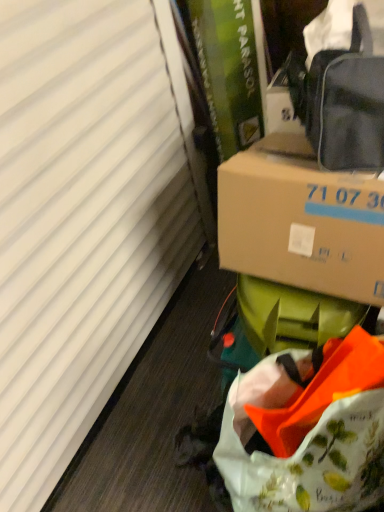
Question: From the image's perspective, is matte black bag at upper right beneath floral printed fabric bag at lower right?

Choices:
 (A) yes
 (B) no

Answer: (B)

Question: Does matte black bag at upper right come behind floral printed fabric bag at lower right?

Choices:
 (A) no
 (B) yes

Answer: (B)

Question: Considering the relative positions of matte black bag at upper right and floral printed fabric bag at lower right in the image provided, is matte black bag at upper right in front of floral printed fabric bag at lower right?

Choices:
 (A) yes
 (B) no

Answer: (B)

Question: Is matte black bag at upper right thinner than floral printed fabric bag at lower right?

Choices:
 (A) yes
 (B) no

Answer: (A)

Question: Would you say matte black bag at upper right is a long distance from floral printed fabric bag at lower right?

Choices:
 (A) yes
 (B) no

Answer: (B)

Question: Considering their positions, is floral printed fabric bag at lower right located in front of or behind white matte curtain at left?

Choices:
 (A) behind
 (B) front

Answer: (A)

Question: From a real-world perspective, is floral printed fabric bag at lower right positioned above or below white matte curtain at left?

Choices:
 (A) above
 (B) below

Answer: (B)

Question: Based on their sizes in the image, would you say floral printed fabric bag at lower right is bigger or smaller than white matte curtain at left?

Choices:
 (A) small
 (B) big

Answer: (A)

Question: Is floral printed fabric bag at lower right taller or shorter than white matte curtain at left?

Choices:
 (A) tall
 (B) short

Answer: (B)

Question: In terms of size, does matte black bag at upper right appear bigger or smaller than floral printed fabric bag at lower right?

Choices:
 (A) small
 (B) big

Answer: (A)

Question: From a real-world perspective, is matte black bag at upper right physically located above or below floral printed fabric bag at lower right?

Choices:
 (A) below
 (B) above

Answer: (B)

Question: From the image's perspective, is matte black bag at upper right above or below floral printed fabric bag at lower right?

Choices:
 (A) below
 (B) above

Answer: (B)

Question: Relative to floral printed fabric bag at lower right, is matte black bag at upper right in front or behind?

Choices:
 (A) behind
 (B) front

Answer: (A)

Question: Considering the positions of brown cardboard box at center-right and matte black bag at upper right in the image, is brown cardboard box at center-right taller or shorter than matte black bag at upper right?

Choices:
 (A) short
 (B) tall

Answer: (A)

Question: Would you say brown cardboard box at center-right is to the left or to the right of matte black bag at upper right in the picture?

Choices:
 (A) left
 (B) right

Answer: (A)